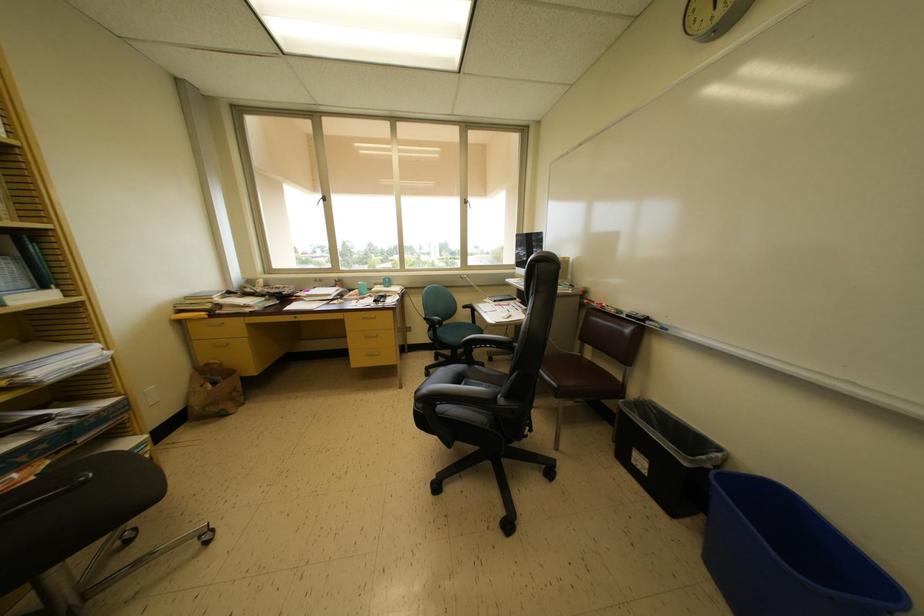
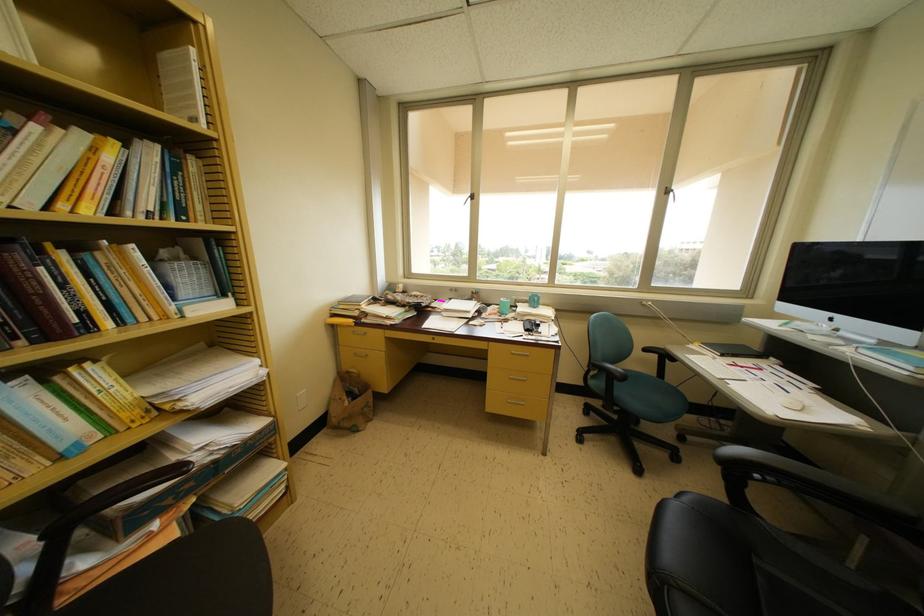
The point at (385, 304) is marked in the first image. Where is the corresponding point in the second image?

(537, 331)